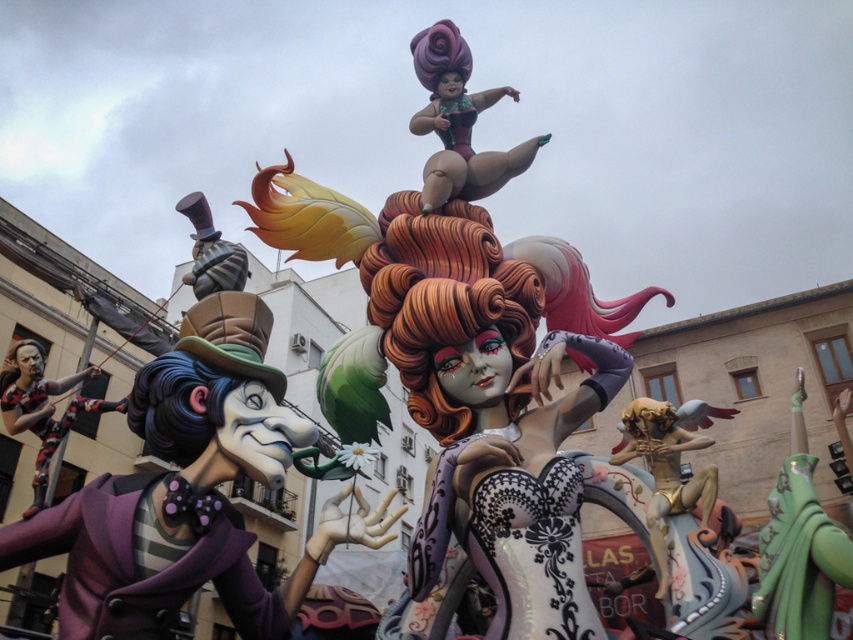
You are a photographer standing at the camera position. You want to take a photo of the purple matte doll at upper center. If your camera has a maximum focus range of 40 meters, will you be able to focus on the doll?

The distance between the purple matte doll at upper center and the camera is 45.38 meters, which exceeds the camera maximum focus range of 40 meters. Therefore, you cannot focus on the doll.

Looking at this image, you are designing a new float for a parade and want to ensure proper spacing between the green fabric doll at center and the black matte figure at left. Given their sizes, which one requires more horizontal space to accommodate its width?

The black matte figure at left requires more horizontal space because it has a greater width than the green fabric doll at center.

You are a photographer standing in front of the float and want to capture both the matte purple suit at left and the shiny silver top hat at upper left in the same frame. Which object should you focus on first to ensure both are in the shot?

Result: The matte purple suit at left is taller than the shiny silver top hat at upper left, so you should focus on the taller matte purple suit at left first to ensure both are in the shot.